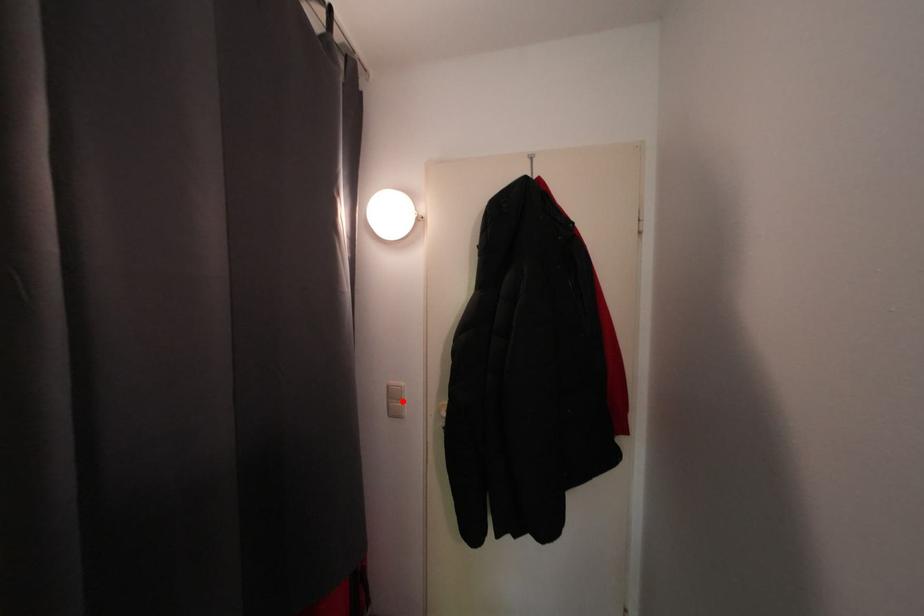
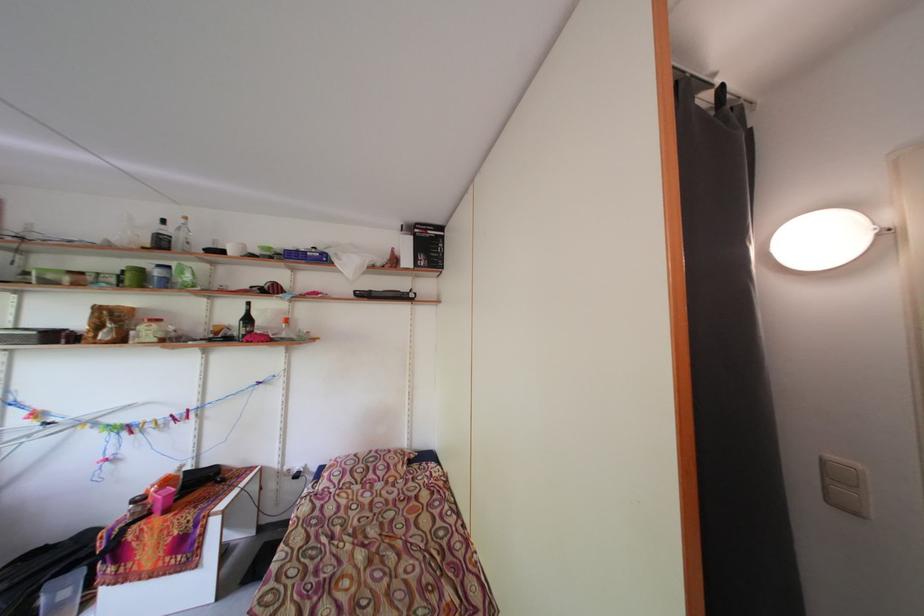
The point at the highlighted location is marked in the first image. Where is the corresponding point in the second image?

(844, 480)